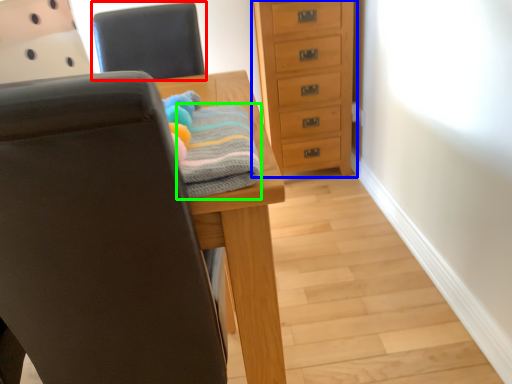
Question: Estimate the real-world distances between objects in this image. Which object is closer to chair (highlighted by a red box), chest of drawers (highlighted by a blue box) or bath towel (highlighted by a green box)?

Choices:
 (A) chest of drawers
 (B) bath towel

Answer: (A)